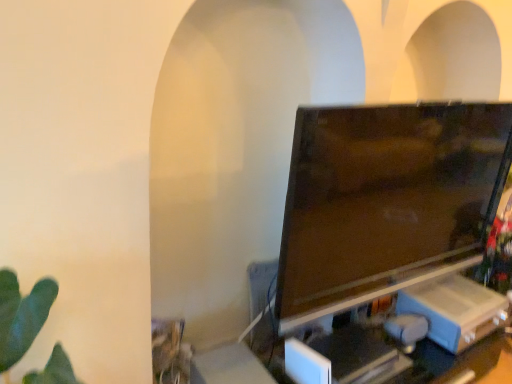
Question: Are matte black tv at center and black plastic computer desk at lower right beside each other?

Choices:
 (A) no
 (B) yes

Answer: (A)

Question: Is matte black tv at center turned away from black plastic computer desk at lower right?

Choices:
 (A) no
 (B) yes

Answer: (A)

Question: Is matte black tv at center shorter than black plastic computer desk at lower right?

Choices:
 (A) yes
 (B) no

Answer: (B)

Question: Considering the relative sizes of matte black tv at center and black plastic computer desk at lower right in the image provided, is matte black tv at center thinner than black plastic computer desk at lower right?

Choices:
 (A) yes
 (B) no

Answer: (A)

Question: Is matte black tv at center closer to camera compared to black plastic computer desk at lower right?

Choices:
 (A) yes
 (B) no

Answer: (A)

Question: Is the position of matte black tv at center more distant than that of black plastic computer desk at lower right?

Choices:
 (A) yes
 (B) no

Answer: (B)

Question: From the image's perspective, is black plastic computer desk at lower right beneath matte black tv at center?

Choices:
 (A) no
 (B) yes

Answer: (B)

Question: Does black plastic computer desk at lower right have a larger size compared to matte black tv at center?

Choices:
 (A) yes
 (B) no

Answer: (A)

Question: Is black plastic computer desk at lower right wider than matte black tv at center?

Choices:
 (A) no
 (B) yes

Answer: (B)

Question: Can you confirm if black plastic computer desk at lower right is thinner than matte black tv at center?

Choices:
 (A) no
 (B) yes

Answer: (A)

Question: Is black plastic computer desk at lower right in contact with matte black tv at center?

Choices:
 (A) yes
 (B) no

Answer: (B)

Question: Is matte black tv at center surrounded by black plastic computer desk at lower right?

Choices:
 (A) no
 (B) yes

Answer: (A)

Question: Do you think black plastic computer desk at lower right is within matte black tv at center, or outside of it?

Choices:
 (A) outside
 (B) inside

Answer: (A)